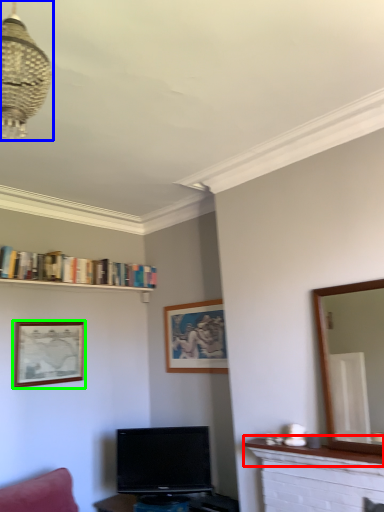
Question: Which is nearer to the mantle (highlighted by a red box)? light fixture (highlighted by a blue box) or picture frame (highlighted by a green box).

Choices:
 (A) light fixture
 (B) picture frame

Answer: (B)